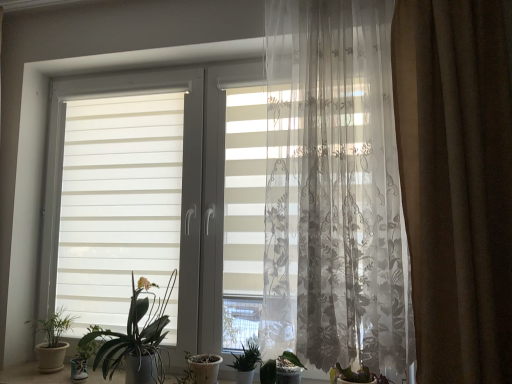
Describe the element at coordinates (188, 187) in the screenshot. I see `white striped window at center` at that location.

How much space does green leafy plant at center, which is the 3th houseplant in left-to-right order, occupy vertically?

9.61 inches.

What do you see at coordinates (281, 370) in the screenshot? I see `green matte leafy plant at lower center, marked as the fourth houseplant in a left-to-right arrangement` at bounding box center [281, 370].

Identify the location of green matte leafy plant at lower center, marked as the fourth houseplant in a left-to-right arrangement. The width and height of the screenshot is (512, 384). (281, 370).

Image resolution: width=512 pixels, height=384 pixels. What do you see at coordinates (52, 341) in the screenshot?
I see `green matte plant at lower left, placed as the 4th houseplant when sorted from right to left` at bounding box center [52, 341].

Image resolution: width=512 pixels, height=384 pixels. In order to click on white striped window at center in this screenshot , I will do `click(188, 187)`.

Can you tell me how much green leafy plant at center, acting as the second houseplant starting from the right, and green matte leafy plant at lower center, marked as the fourth houseplant in a left-to-right arrangement, differ in facing direction?

They differ by 0.000217 degrees in their facing directions.

Between point (251, 365) and point (284, 377), which one is positioned behind?

The point (251, 365) is farther from the camera.

Consider the image. Is green leafy plant at center, which is the 3th houseplant in left-to-right order, to the left of green matte leafy plant at lower center, marked as the fourth houseplant in a left-to-right arrangement, from the viewer's perspective?

Yes.

Can you confirm if green leafy plant at center, which is the 3th houseplant in left-to-right order, is shorter than green matte leafy plant at lower center, marked as the fourth houseplant in a left-to-right arrangement?

In fact, green leafy plant at center, which is the 3th houseplant in left-to-right order, may be taller than green matte leafy plant at lower center, marked as the fourth houseplant in a left-to-right arrangement.

Which is in front, green matte plant at lower left, placed as the 4th houseplant when sorted from right to left, or green matte plant at center, the 3th houseplant positioned from the right?

green matte plant at center, the 3th houseplant positioned from the right.

Who is taller, green matte plant at lower left, the 1th houseplant in the left-to-right sequence, or green matte plant at center, the 2th houseplant viewed from the left?

green matte plant at center, the 2th houseplant viewed from the left, is taller.

The width and height of the screenshot is (512, 384). What are the coordinates of `houseplant that appears on the left of green matte plant at center, the 2th houseplant viewed from the left` in the screenshot? It's located at (52, 341).

Could you tell me if green matte plant at lower left, placed as the 4th houseplant when sorted from right to left, is turned towards green matte plant at center, the 2th houseplant viewed from the left?

No, green matte plant at lower left, placed as the 4th houseplant when sorted from right to left, is not facing towards green matte plant at center, the 2th houseplant viewed from the left.

Would you say green matte leafy plant at lower center, the 1th houseplant from the right, contains white striped window at center?

That's incorrect, white striped window at center is not inside green matte leafy plant at lower center, the 1th houseplant from the right.

Is the depth of green matte leafy plant at lower center, marked as the fourth houseplant in a left-to-right arrangement, greater than that of white striped window at center?

No, it is in front of white striped window at center.

Considering the sizes of objects green matte leafy plant at lower center, marked as the fourth houseplant in a left-to-right arrangement, and white striped window at center in the image provided, who is shorter, green matte leafy plant at lower center, marked as the fourth houseplant in a left-to-right arrangement, or white striped window at center?

Standing shorter between the two is green matte leafy plant at lower center, marked as the fourth houseplant in a left-to-right arrangement.

Is green matte leafy plant at lower center, the 1th houseplant from the right, not near white striped window at center?

No.

Consider the image. Does sheer floral-patterned curtain at center, acting as the second curtain starting from the right, have a lesser height compared to green matte plant at lower left, placed as the 4th houseplant when sorted from right to left?

Incorrect, the height of sheer floral-patterned curtain at center, acting as the second curtain starting from the right, does not fall short of that of green matte plant at lower left, placed as the 4th houseplant when sorted from right to left.

Is sheer floral-patterned curtain at center, positioned as the 1th curtain in left-to-right order, far away from green matte plant at lower left, the 1th houseplant in the left-to-right sequence?

Yes, sheer floral-patterned curtain at center, positioned as the 1th curtain in left-to-right order, and green matte plant at lower left, the 1th houseplant in the left-to-right sequence, are quite far apart.

From the image's perspective, is sheer floral-patterned curtain at center, positioned as the 1th curtain in left-to-right order, below green matte plant at lower left, the 1th houseplant in the left-to-right sequence?

No.

Does sheer floral-patterned curtain at center, acting as the second curtain starting from the right, lie in front of green matte plant at lower left, the 1th houseplant in the left-to-right sequence?

That is True.

Can you tell me how much brown velvet curtain at right, the first curtain positioned from the right, and green leafy plant at center, acting as the second houseplant starting from the right, differ in facing direction?

The angle between the facing direction of brown velvet curtain at right, the first curtain positioned from the right, and the facing direction of green leafy plant at center, acting as the second houseplant starting from the right, is 2.66 degrees.

Between brown velvet curtain at right, which appears as the 2th curtain when viewed from the left, and green leafy plant at center, acting as the second houseplant starting from the right, which one appears on the right side from the viewer's perspective?

brown velvet curtain at right, which appears as the 2th curtain when viewed from the left.

From the image's perspective, would you say brown velvet curtain at right, the first curtain positioned from the right, is shown under green leafy plant at center, which is the 3th houseplant in left-to-right order?

No, from the image's perspective, brown velvet curtain at right, the first curtain positioned from the right, is not beneath green leafy plant at center, which is the 3th houseplant in left-to-right order.

Who is bigger, brown velvet curtain at right, the first curtain positioned from the right, or green leafy plant at center, which is the 3th houseplant in left-to-right order?

brown velvet curtain at right, the first curtain positioned from the right, is bigger.

Between green matte plant at lower left, the 1th houseplant in the left-to-right sequence, and green matte leafy plant at lower center, marked as the fourth houseplant in a left-to-right arrangement, which one appears on the left side from the viewer's perspective?

Positioned to the left is green matte plant at lower left, the 1th houseplant in the left-to-right sequence.

Where is `the 2nd houseplant below the green matte plant at lower left, placed as the 4th houseplant when sorted from right to left (from a real-world perspective)`? This screenshot has height=384, width=512. the 2nd houseplant below the green matte plant at lower left, placed as the 4th houseplant when sorted from right to left (from a real-world perspective) is located at coordinates (281, 370).

Which object is more forward, green matte plant at lower left, the 1th houseplant in the left-to-right sequence, or green matte leafy plant at lower center, marked as the fourth houseplant in a left-to-right arrangement?

green matte leafy plant at lower center, marked as the fourth houseplant in a left-to-right arrangement, is more forward.

Which point is more forward, (60, 313) or (278, 358)?

The point (278, 358) is more forward.

Which is in front, white striped window at center or brown velvet curtain at right, the first curtain positioned from the right?

Positioned in front is brown velvet curtain at right, the first curtain positioned from the right.

From a real-world perspective, which is physically below, white striped window at center or brown velvet curtain at right, which appears as the 2th curtain when viewed from the left?

From a 3D spatial view, white striped window at center is below.

From the image's perspective, is white striped window at center above or below brown velvet curtain at right, the first curtain positioned from the right?

white striped window at center is situated lower than brown velvet curtain at right, the first curtain positioned from the right, in the image.

Based on the photo, who is shorter, white striped window at center or brown velvet curtain at right, which appears as the 2th curtain when viewed from the left?

brown velvet curtain at right, which appears as the 2th curtain when viewed from the left, is shorter.

You are a GUI agent. You are given a task and a screenshot of the screen. Output one action in this format:
    pyautogui.click(x=<x>, y=<y>)
    Task: Click on the 2nd houseplant below the green leafy plant at center, which is the 3th houseplant in left-to-right order (from the image's perspective)
    The width and height of the screenshot is (512, 384).
    Given the screenshot: What is the action you would take?
    pyautogui.click(x=281, y=370)

Where is `houseplant above the green matte plant at lower left, placed as the 4th houseplant when sorted from right to left (from a real-world perspective)`? This screenshot has width=512, height=384. houseplant above the green matte plant at lower left, placed as the 4th houseplant when sorted from right to left (from a real-world perspective) is located at coordinates (136, 337).

From the image, which object appears to be nearer to brown velvet curtain at right, which appears as the 2th curtain when viewed from the left, green leafy plant at center, acting as the second houseplant starting from the right, or green matte plant at center, the 2th houseplant viewed from the left?

green leafy plant at center, acting as the second houseplant starting from the right, lies closer to brown velvet curtain at right, which appears as the 2th curtain when viewed from the left, than the other object.

Looking at the image, which one is located closer to sheer floral-patterned curtain at center, positioned as the 1th curtain in left-to-right order, green matte plant at center, the 2th houseplant viewed from the left, or white striped window at center?

white striped window at center lies closer to sheer floral-patterned curtain at center, positioned as the 1th curtain in left-to-right order, than the other object.

Estimate the real-world distances between objects in this image. Which object is further from brown velvet curtain at right, which appears as the 2th curtain when viewed from the left, sheer floral-patterned curtain at center, acting as the second curtain starting from the right, or green matte plant at lower left, the 1th houseplant in the left-to-right sequence?

green matte plant at lower left, the 1th houseplant in the left-to-right sequence.

Estimate the real-world distances between objects in this image. Which object is closer to green leafy plant at center, which is the 3th houseplant in left-to-right order, brown velvet curtain at right, the first curtain positioned from the right, or green matte plant at center, the 2th houseplant viewed from the left?

green matte plant at center, the 2th houseplant viewed from the left, is closer to green leafy plant at center, which is the 3th houseplant in left-to-right order.

From the image, which object appears to be nearer to sheer floral-patterned curtain at center, acting as the second curtain starting from the right, green matte plant at lower left, the 1th houseplant in the left-to-right sequence, or green leafy plant at center, acting as the second houseplant starting from the right?

Based on the image, green leafy plant at center, acting as the second houseplant starting from the right, appears to be nearer to sheer floral-patterned curtain at center, acting as the second curtain starting from the right.

Looking at the image, which one is located closer to white striped window at center, green matte plant at center, the 2th houseplant viewed from the left, or sheer floral-patterned curtain at center, positioned as the 1th curtain in left-to-right order?

green matte plant at center, the 2th houseplant viewed from the left.

From the image, which object appears to be nearer to green leafy plant at center, acting as the second houseplant starting from the right, green matte plant at lower left, placed as the 4th houseplant when sorted from right to left, or green matte plant at center, the 2th houseplant viewed from the left?

green matte plant at center, the 2th houseplant viewed from the left, lies closer to green leafy plant at center, acting as the second houseplant starting from the right, than the other object.

When comparing their distances from green matte leafy plant at lower center, the 1th houseplant from the right, does white striped window at center or green leafy plant at center, which is the 3th houseplant in left-to-right order, seem closer?

green leafy plant at center, which is the 3th houseplant in left-to-right order, lies closer to green matte leafy plant at lower center, the 1th houseplant from the right, than the other object.

Find the location of a particular element. The width and height of the screenshot is (512, 384). curtain between white striped window at center and brown velvet curtain at right, which appears as the 2th curtain when viewed from the left, from left to right is located at coordinates (334, 190).

Find the location of `curtain that lies between sheer floral-patterned curtain at center, positioned as the 1th curtain in left-to-right order, and green leafy plant at center, which is the 3th houseplant in left-to-right order, from top to bottom`. curtain that lies between sheer floral-patterned curtain at center, positioned as the 1th curtain in left-to-right order, and green leafy plant at center, which is the 3th houseplant in left-to-right order, from top to bottom is located at coordinates (456, 182).

In order to click on curtain situated between green matte plant at lower left, the 1th houseplant in the left-to-right sequence, and brown velvet curtain at right, which appears as the 2th curtain when viewed from the left, from left to right in this screenshot , I will do `click(334, 190)`.

Find the location of a particular element. The width and height of the screenshot is (512, 384). window between green matte plant at lower left, placed as the 4th houseplant when sorted from right to left, and brown velvet curtain at right, which appears as the 2th curtain when viewed from the left is located at coordinates (188, 187).